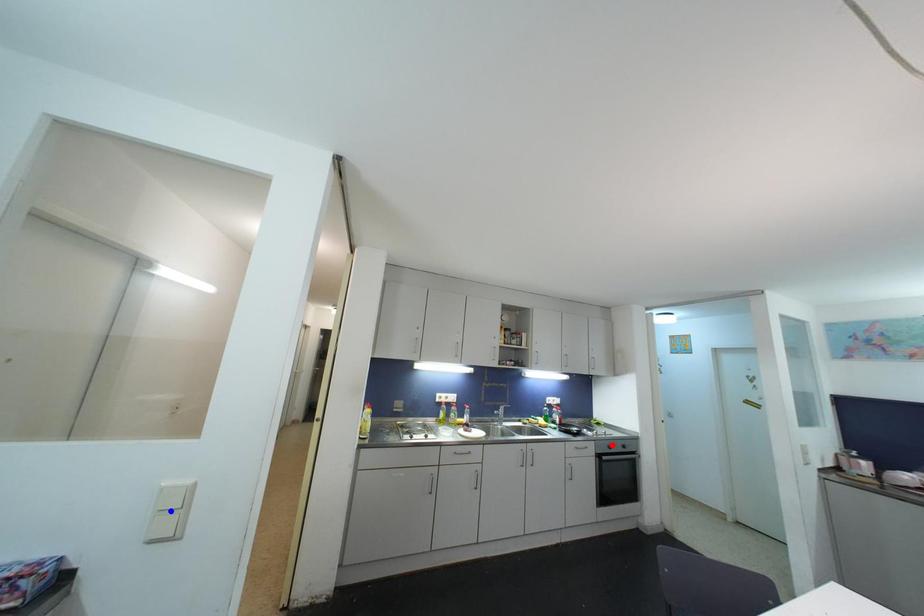
Question: Which of the two points in the image is closer to the camera?

Choices:
 (A) Blue point is closer.
 (B) Red point is closer.

Answer: (A)